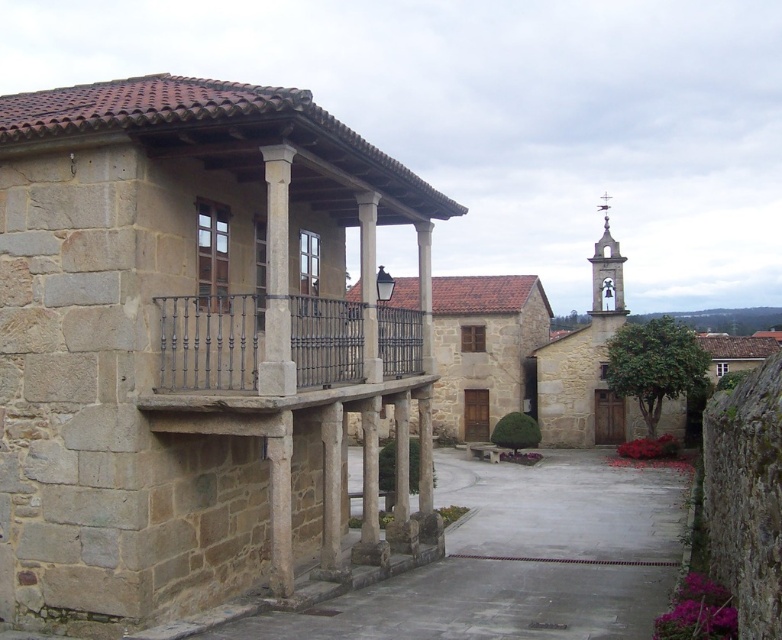
Question: Can you confirm if black wrought iron balcony at center is positioned to the left of smooth stone bell tower at upper right?

Choices:
 (A) yes
 (B) no

Answer: (A)

Question: Which of the following is the closest to the observer?

Choices:
 (A) smooth stone bell tower at upper right
 (B) black wrought iron balcony at center

Answer: (B)

Question: Which point is closer to the camera?

Choices:
 (A) smooth stone bell tower at upper right
 (B) black wrought iron balcony at center

Answer: (B)

Question: Can you confirm if black wrought iron balcony at center is smaller than smooth stone bell tower at upper right?

Choices:
 (A) no
 (B) yes

Answer: (B)

Question: Does black wrought iron balcony at center lie behind smooth stone bell tower at upper right?

Choices:
 (A) yes
 (B) no

Answer: (B)